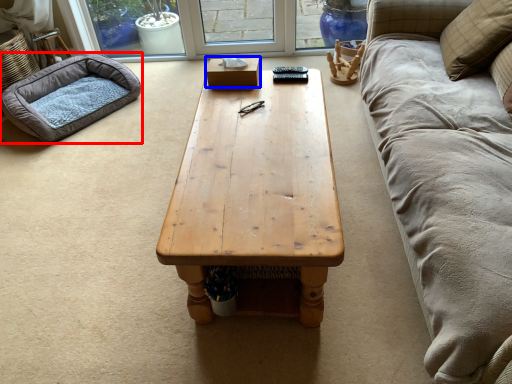
Question: Which object appears farthest to the camera in this image, dog bed (highlighted by a red box) or box (highlighted by a blue box)?

Choices:
 (A) dog bed
 (B) box

Answer: (A)